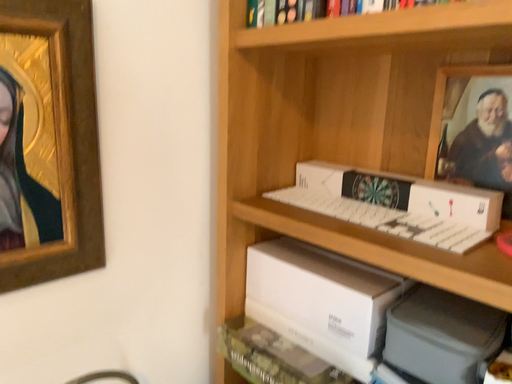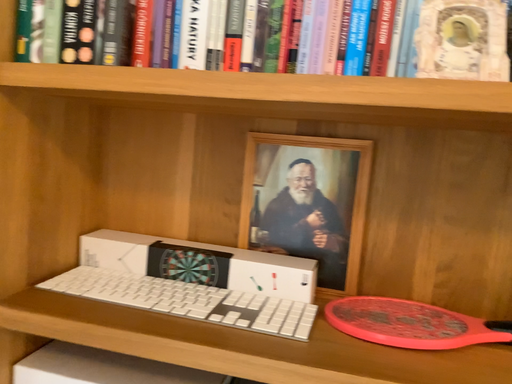
Question: Which way did the camera rotate in the video?

Choices:
 (A) rotated left
 (B) rotated right

Answer: (B)